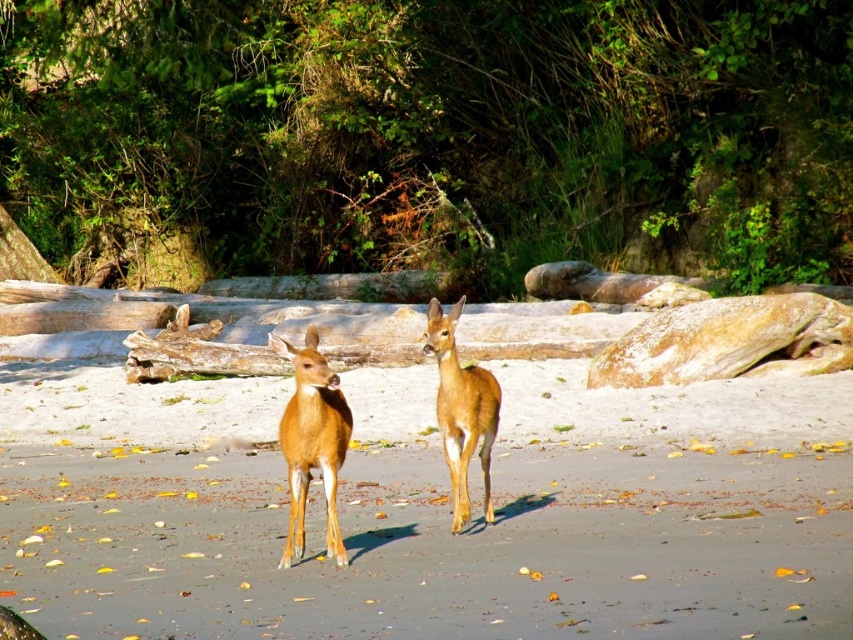
Question: Among these objects, which one is nearest to the camera?

Choices:
 (A) shiny brown deer at center
 (B) brown sandy beach at center
 (C) brown matte/deer at center

Answer: (B)

Question: Does shiny brown deer at center have a smaller size compared to brown matte/deer at center?

Choices:
 (A) no
 (B) yes

Answer: (B)

Question: Is shiny brown deer at center further to camera compared to brown matte/deer at center?

Choices:
 (A) no
 (B) yes

Answer: (A)

Question: Among these objects, which one is farthest from the camera?

Choices:
 (A) shiny brown deer at center
 (B) brown sandy beach at center

Answer: (A)

Question: Can you confirm if brown sandy beach at center is wider than brown matte/deer at center?

Choices:
 (A) yes
 (B) no

Answer: (A)

Question: Among these points, which one is farthest from the camera?

Choices:
 (A) (463, 413)
 (B) (349, 422)
 (C) (19, 387)

Answer: (C)